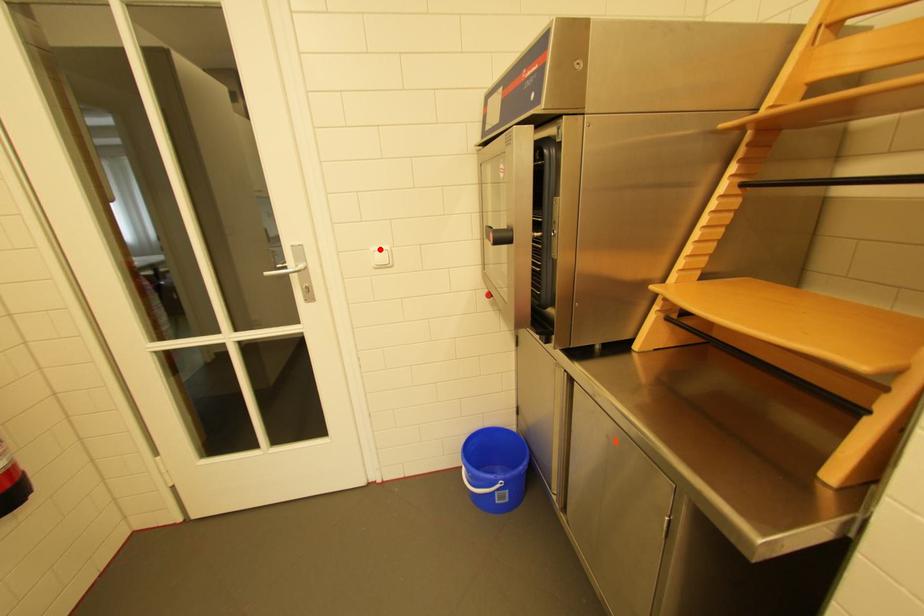
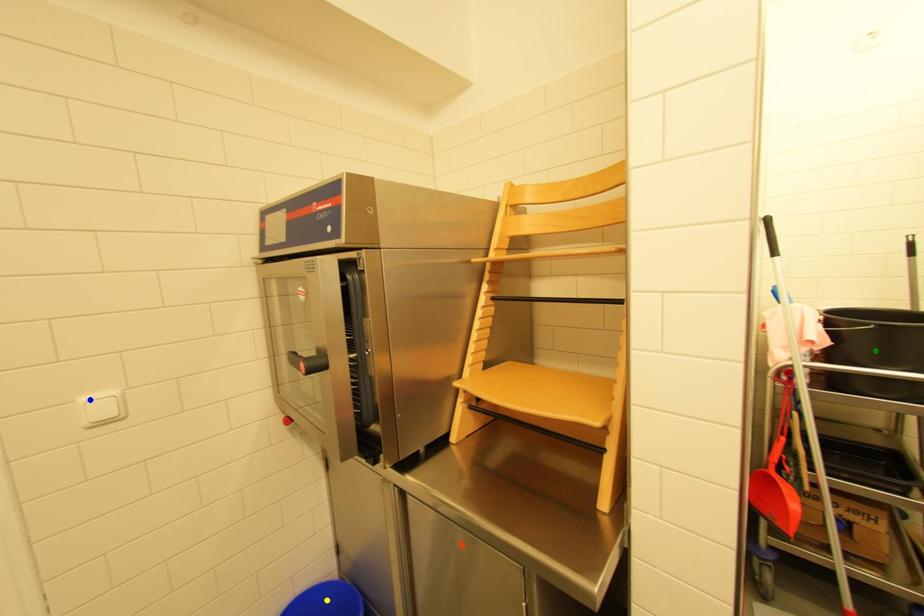
Question: I am providing you with two images of the same scene from different viewpoints. A red point is marked on the first image. You are given multiple points on the second image. Which point in image 2 represents the same 3d spot as the red point in image 1?

Choices:
 (A) blue point
 (B) yellow point
 (C) green point

Answer: (A)